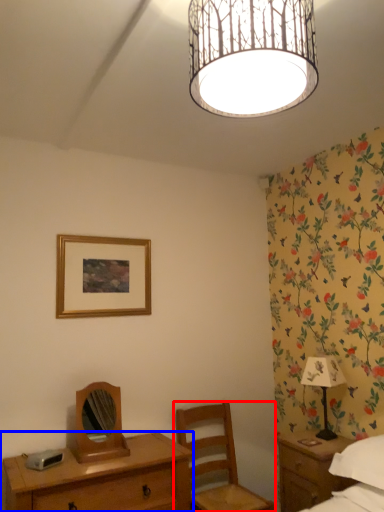
Question: Which point is closer to the camera, chair (highlighted by a red box) or desk (highlighted by a blue box)?

Choices:
 (A) chair
 (B) desk

Answer: (B)